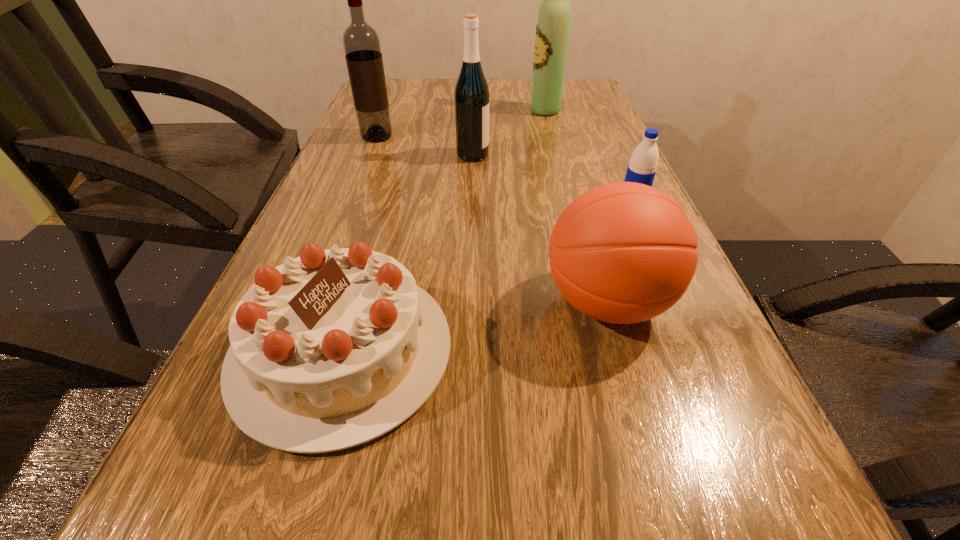
Find the location of a particular element. wine bottle that is at the right edge is located at coordinates (553, 25).

This screenshot has width=960, height=540. I want to click on basketball at the right edge, so click(624, 252).

The width and height of the screenshot is (960, 540). Find the location of `water bottle that is at the right edge`. water bottle that is at the right edge is located at coordinates (642, 167).

Where is `object that is at the far right corner`? This screenshot has height=540, width=960. object that is at the far right corner is located at coordinates (553, 25).

The image size is (960, 540). In the image, there is a desktop. What are the coordinates of `vacant space at the far edge` in the screenshot? It's located at (516, 99).

In the image, there is a desktop. Identify the location of vacant space at the left edge. Image resolution: width=960 pixels, height=540 pixels. (218, 521).

Where is `free space at the right edge of the desktop`? free space at the right edge of the desktop is located at coordinates (575, 141).

The height and width of the screenshot is (540, 960). Find the location of `free space at the far right corner of the desktop`. free space at the far right corner of the desktop is located at coordinates (579, 90).

The image size is (960, 540). Find the location of `free area in between the third shortest object and the fourth shortest object`. free area in between the third shortest object and the fourth shortest object is located at coordinates (540, 228).

This screenshot has width=960, height=540. In order to click on vacant area between the birthday cake and the rightmost wine bottle in this screenshot , I will do `click(444, 231)`.